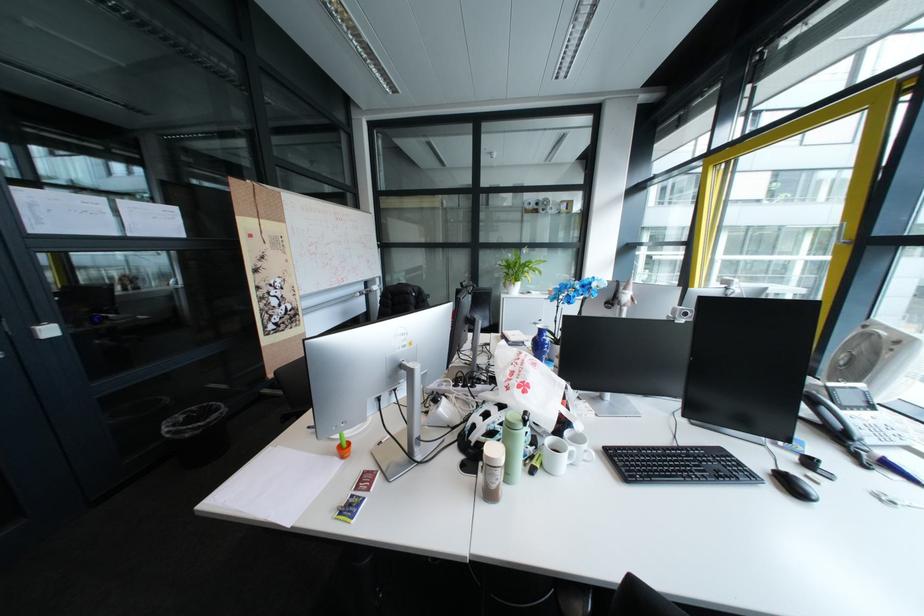
Where would you push the black computer mouse? Please return your answer as a coordinate pair (x, y).

(795, 485)